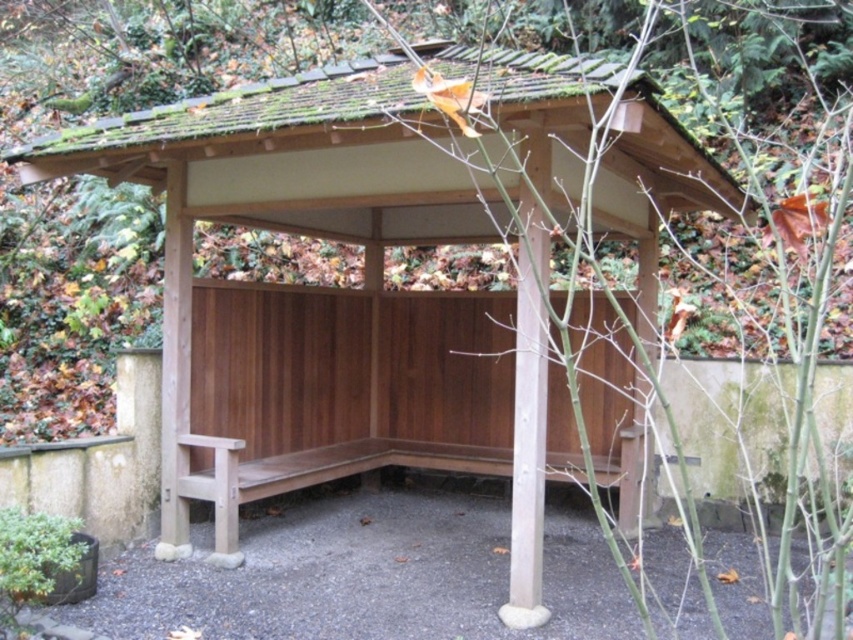
Is point (376, 243) behind point (218, 490)?

Yes, it is.

Can you confirm if wooden bench at center is bigger than wooden bench at lower left?

Correct, wooden bench at center is larger in size than wooden bench at lower left.

Does point (376, 109) come closer to viewer compared to point (641, 449)?

Yes, it is.

Locate an element on the screen. The width and height of the screenshot is (853, 640). wooden bench at center is located at coordinates (390, 237).